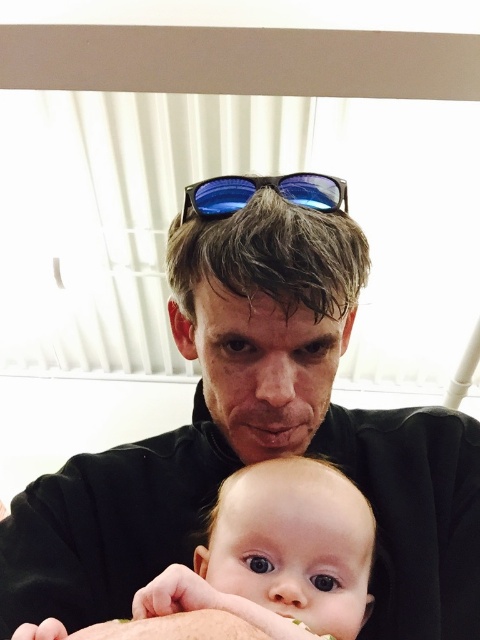
You are a photographer setting up a shoot. You notice the black matte shirt at center and the blue reflective lenses at center in the scene. Which object should you adjust your camera settings for if you want to ensure both are properly exposed, considering their size differences?

The black matte shirt at center has a larger size compared to blue reflective lenses at center, so you should adjust the camera settings to prioritize the exposure for the larger black matte shirt at center to ensure it is properly lit and details are captured clearly.

You are a photographer setting up a shoot. You notice the black matte shirt at center and the blue reflective lenses at center in the scene. To avoid glare from the window, which object should you position to the right to block the light?

The black matte shirt at center is to the left of blue reflective lenses at center, so moving the black matte shirt at center to the right would position it between the blue reflective lenses at center and the window, blocking the light.